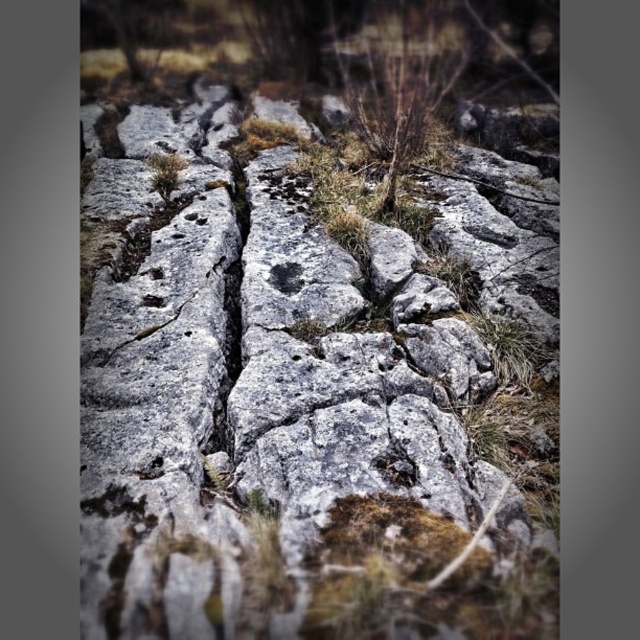
Question: Is gray rough rock at center below gray stone at center?

Choices:
 (A) no
 (B) yes

Answer: (A)

Question: Which object is closer to the camera taking this photo?

Choices:
 (A) gray stone at center
 (B) gray rough rock at center

Answer: (B)

Question: Which point appears closest to the camera in this image?

Choices:
 (A) (160, 168)
 (B) (316, 513)
 (C) (284, 273)

Answer: (B)

Question: Considering the relative positions of gray rough rock at center and gray stone at center in the image provided, where is gray rough rock at center located with respect to gray stone at center?

Choices:
 (A) right
 (B) left

Answer: (A)

Question: Does gray rough rock at center appear on the left side of green mossy rock at upper center?

Choices:
 (A) yes
 (B) no

Answer: (B)

Question: Among these objects, which one is farthest from the camera?

Choices:
 (A) green mossy rock at upper center
 (B) gray stone at center

Answer: (A)